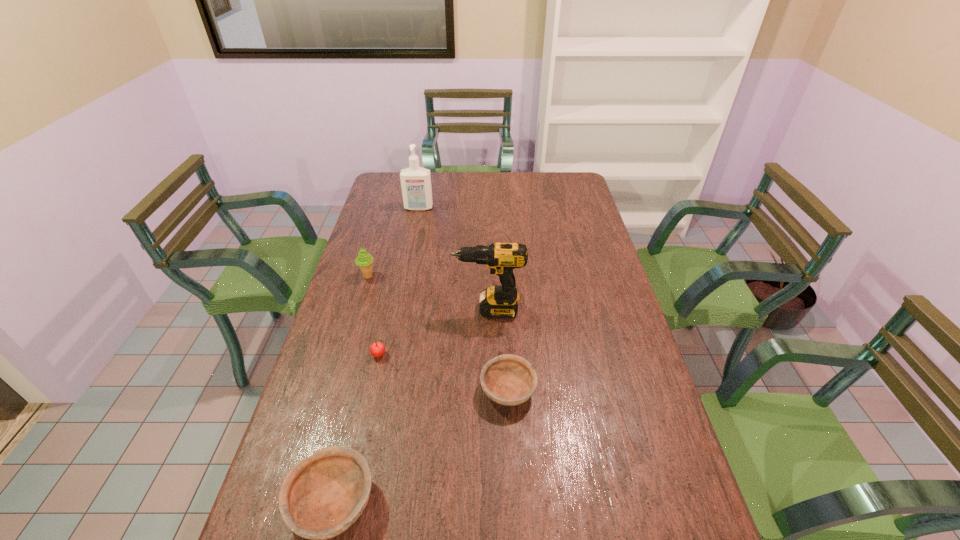
Locate an element on the screen. The height and width of the screenshot is (540, 960). free spot at the right edge of the desktop is located at coordinates (585, 288).

Where is `vacant space at the near left corner of the desktop`? The image size is (960, 540). vacant space at the near left corner of the desktop is located at coordinates (285, 539).

Find the location of `blank region between the third shortest object and the icecream`. blank region between the third shortest object and the icecream is located at coordinates (373, 316).

Find the location of a particular element. This screenshot has width=960, height=540. unoccupied area between the farthest object and the drill is located at coordinates click(453, 259).

Locate an element on the screen. The width and height of the screenshot is (960, 540). free space between the fifth farthest object and the third shortest object is located at coordinates (444, 373).

The width and height of the screenshot is (960, 540). What are the coordinates of `vacant region between the right bowl and the fourth nearest object` in the screenshot? It's located at coord(498,350).

At what (x,y) coordinates should I click in order to perform the action: click on empty space that is in between the drill and the farthest object. Please return your answer as a coordinate pair (x, y). The width and height of the screenshot is (960, 540). Looking at the image, I should click on (x=453, y=259).

This screenshot has height=540, width=960. Identify the location of object that is the second closest one to the fourth shortest object. (377, 349).

Point out which object is positioned as the third nearest to the fourth farthest object. Please provide its 2D coordinates. Your answer should be formatted as a tuple, i.e. [(x, y)], where the tuple contains the x and y coordinates of a point satisfying the conditions above.

[(323, 495)]

Find the location of a particular element. vacant area in the image that satisfies the following two spatial constraints: 1. on the front label of the right bowl; 2. on the left side of the cleansing agent is located at coordinates (383, 390).